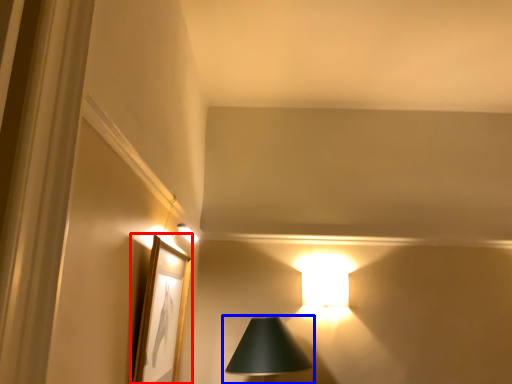
Question: Which point is closer to the camera, picture frame (highlighted by a red box) or lamp (highlighted by a blue box)?

Choices:
 (A) picture frame
 (B) lamp

Answer: (A)